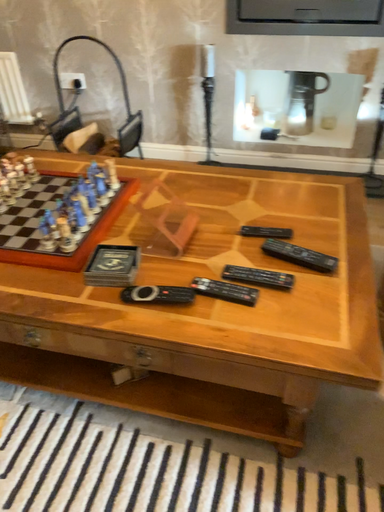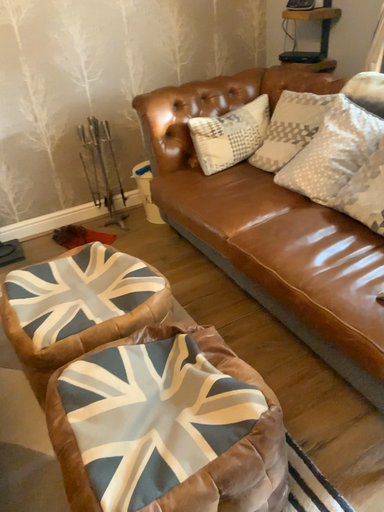
Question: How did the camera likely rotate when shooting the video?

Choices:
 (A) rotated right
 (B) rotated left

Answer: (A)